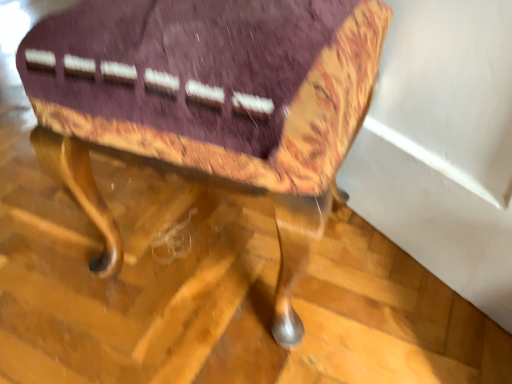
This screenshot has width=512, height=384. Describe the element at coordinates (210, 104) in the screenshot. I see `purple velvet ottoman at center` at that location.

The height and width of the screenshot is (384, 512). Identify the location of purple velvet ottoman at center. (210, 104).

Image resolution: width=512 pixels, height=384 pixels. Identify the location of purple velvet ottoman at center. (210, 104).